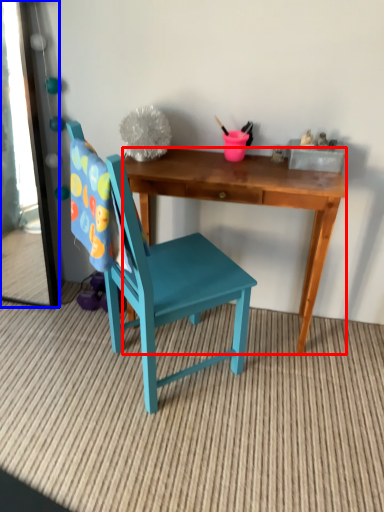
Question: Among these objects, which one is farthest to the camera, desk (highlighted by a red box) or mirror (highlighted by a blue box)?

Choices:
 (A) desk
 (B) mirror

Answer: (B)